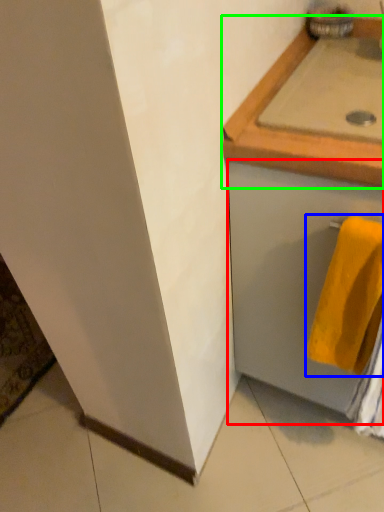
Question: Estimate the real-world distances between objects in this image. Which object is farther from drawer (highlighted by a red box), towel (highlighted by a blue box) or countertop (highlighted by a green box)?

Choices:
 (A) towel
 (B) countertop

Answer: (B)